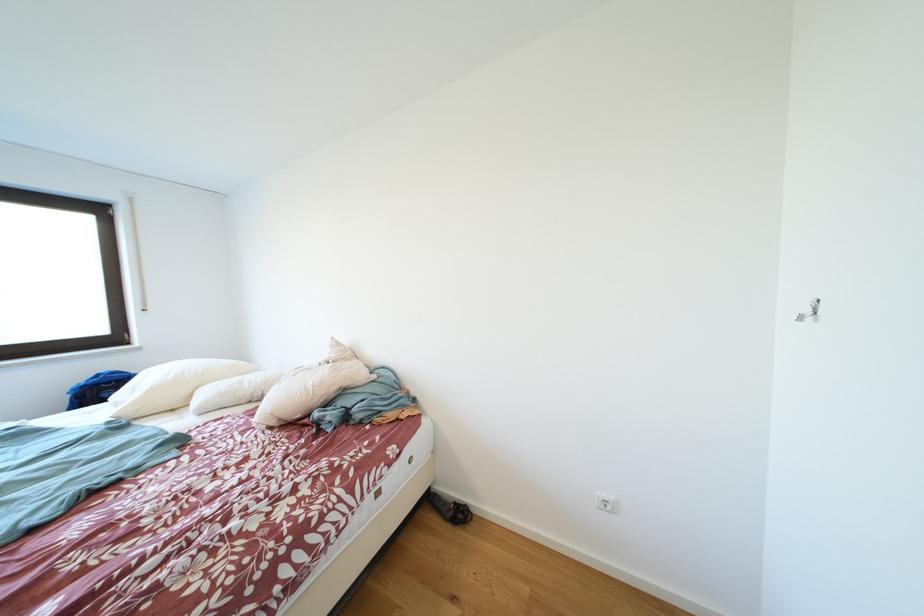
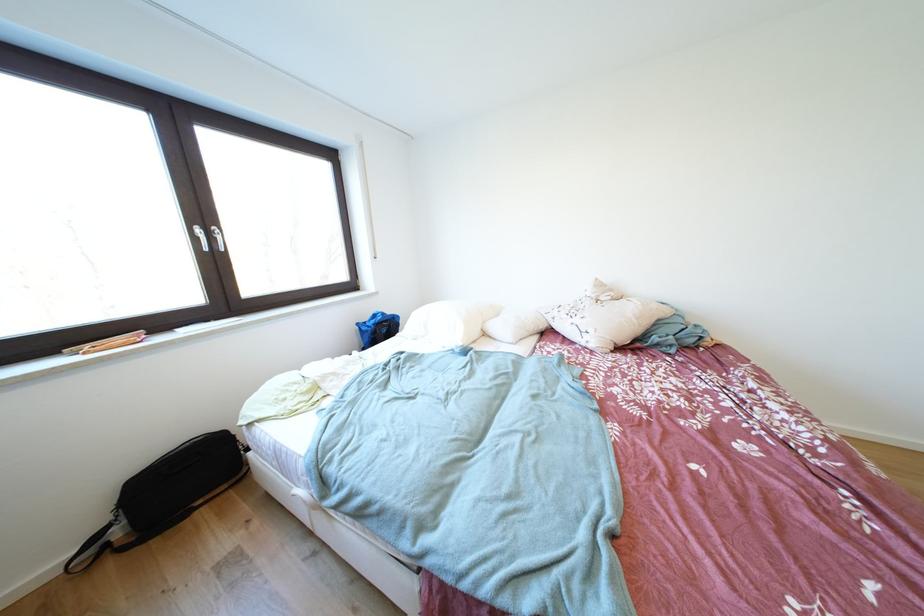
Question: In a continuous first-person perspective shot, in which direction is the camera moving?

Choices:
 (A) Left
 (B) Right
 (C) Forward
 (D) Backward

Answer: (A)